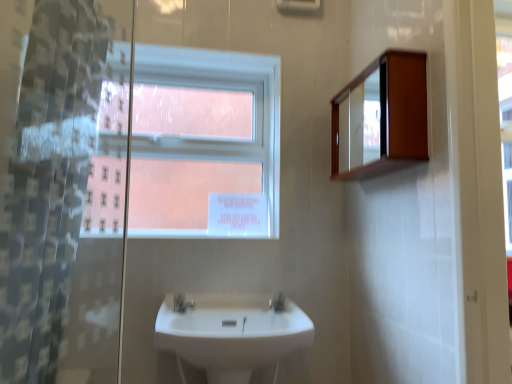
This screenshot has height=384, width=512. I want to click on white glossy sink at center, so click(231, 334).

Identify the location of white glossy tap at center, the 1th tap viewed from the right. (277, 302).

The height and width of the screenshot is (384, 512). Describe the element at coordinates (381, 118) in the screenshot. I see `wooden medicine cabinet at upper right` at that location.

Find the location of a particular element. The height and width of the screenshot is (384, 512). white plastic window at upper center is located at coordinates (204, 144).

You are a GUI agent. You are given a task and a screenshot of the screen. Output one action in this format:
    pyautogui.click(x=<x>, y=<y>)
    Task: Click on the white glossy sink at center
    The image size is (512, 384).
    Given the screenshot: What is the action you would take?
    pyautogui.click(x=231, y=334)

From the picture: Can you confirm if white glossy sink at center is positioned to the left of wooden medicine cabinet at upper right?

Indeed, white glossy sink at center is positioned on the left side of wooden medicine cabinet at upper right.

Who is bigger, white glossy sink at center or wooden medicine cabinet at upper right?

white glossy sink at center.

Which of these two, white glossy sink at center or wooden medicine cabinet at upper right, is thinner?

wooden medicine cabinet at upper right.

Is point (216, 298) behind point (393, 157)?

Yes, it is.

Is silver metallic tap at center, which is counted as the first tap, starting from the left, far from white plastic window at upper center?

That's not correct — silver metallic tap at center, which is counted as the first tap, starting from the left, is a little close to white plastic window at upper center.

Which is behind, point (182, 297) or point (238, 55)?

The point (238, 55) is more distant.

This screenshot has height=384, width=512. Find the location of `window above the silver metallic tap at center, which is counted as the first tap, starting from the left (from a real-world perspective)`. window above the silver metallic tap at center, which is counted as the first tap, starting from the left (from a real-world perspective) is located at coordinates (204, 144).

From a real-world perspective, is silver metallic tap at center, the second tap viewed from the right, physically below white plastic window at upper center?

Yes.

From the image's perspective, which object appears higher, clear plastic shower curtain at left or wooden medicine cabinet at upper right?

wooden medicine cabinet at upper right.

This screenshot has height=384, width=512. Find the location of `shower curtain that appears on the left of wooden medicine cabinet at upper right`. shower curtain that appears on the left of wooden medicine cabinet at upper right is located at coordinates (x=48, y=183).

Which is nearer, (26, 300) or (354, 93)?

The point (26, 300) is in front.

Measure the distance from wooden medicine cabinet at upper right to clear plastic shower curtain at left.

wooden medicine cabinet at upper right is 3.50 feet from clear plastic shower curtain at left.

From a real-world perspective, is wooden medicine cabinet at upper right located higher than clear plastic shower curtain at left?

Yes, from a real-world perspective, wooden medicine cabinet at upper right is on top of clear plastic shower curtain at left.

Considering the relative sizes of wooden medicine cabinet at upper right and clear plastic shower curtain at left in the image provided, is wooden medicine cabinet at upper right smaller than clear plastic shower curtain at left?

Actually, wooden medicine cabinet at upper right might be larger than clear plastic shower curtain at left.

Which is nearer, (x=369, y=88) or (x=35, y=171)?

Point (x=369, y=88) appears to be farther away from the viewer than point (x=35, y=171).

Is the surface of white glossy tap at center, the 2th tap in the left-to-right sequence, in direct contact with wooden medicine cabinet at upper right?

They are not placed beside each other.

In terms of width, does white glossy tap at center, the 1th tap viewed from the right, look wider or thinner when compared to wooden medicine cabinet at upper right?

Clearly, white glossy tap at center, the 1th tap viewed from the right, has less width compared to wooden medicine cabinet at upper right.

How different are the orientations of white glossy tap at center, the 2th tap in the left-to-right sequence, and wooden medicine cabinet at upper right in degrees?

There is a 60.9-degree angle between the facing directions of white glossy tap at center, the 2th tap in the left-to-right sequence, and wooden medicine cabinet at upper right.

Between white glossy tap at center, the 2th tap in the left-to-right sequence, and wooden medicine cabinet at upper right, which one has larger size?

wooden medicine cabinet at upper right is bigger.

Does silver metallic tap at center, the second tap viewed from the right, turn towards wooden medicine cabinet at upper right?

No, silver metallic tap at center, the second tap viewed from the right, is not turned towards wooden medicine cabinet at upper right.

From the image's perspective, is silver metallic tap at center, which is counted as the first tap, starting from the left, positioned above or below wooden medicine cabinet at upper right?

Clearly, from the image's perspective, silver metallic tap at center, which is counted as the first tap, starting from the left, is below wooden medicine cabinet at upper right.

Which point is more distant from viewer, (193, 301) or (333, 127)?

The point (333, 127) is farther.

Which object is positioned more to the left, silver metallic tap at center, which is counted as the first tap, starting from the left, or wooden medicine cabinet at upper right?

silver metallic tap at center, which is counted as the first tap, starting from the left.

Considering the relative sizes of white plastic window at upper center and clear plastic shower curtain at left in the image provided, is white plastic window at upper center smaller than clear plastic shower curtain at left?

Actually, white plastic window at upper center might be larger than clear plastic shower curtain at left.

Can you confirm if white plastic window at upper center is shorter than clear plastic shower curtain at left?

Yes, white plastic window at upper center is shorter than clear plastic shower curtain at left.

Is white plastic window at upper center wider or thinner than clear plastic shower curtain at left?

white plastic window at upper center is wider than clear plastic shower curtain at left.

Identify the location of sink that appears below the wooden medicine cabinet at upper right (from the image's perspective). The image size is (512, 384). (231, 334).

Locate an element on the screen. window above the silver metallic tap at center, the second tap viewed from the right (from a real-world perspective) is located at coordinates (204, 144).

Estimate the real-world distances between objects in this image. Which object is closer to white plastic window at upper center, wooden medicine cabinet at upper right or clear plastic shower curtain at left?

Among the two, wooden medicine cabinet at upper right is located nearer to white plastic window at upper center.

From the image, which object appears to be farther from white plastic window at upper center, clear plastic shower curtain at left or white glossy tap at center, the 2th tap in the left-to-right sequence?

white glossy tap at center, the 2th tap in the left-to-right sequence, is further to white plastic window at upper center.

Looking at the image, which one is located closer to clear plastic shower curtain at left, white plastic window at upper center or wooden medicine cabinet at upper right?

white plastic window at upper center is closer to clear plastic shower curtain at left.

Considering their positions, is white glossy sink at center positioned closer to white glossy tap at center, the 2th tap in the left-to-right sequence, than wooden medicine cabinet at upper right?

white glossy sink at center lies closer to white glossy tap at center, the 2th tap in the left-to-right sequence, than the other object.

Considering their positions, is wooden medicine cabinet at upper right positioned further to white glossy tap at center, the 2th tap in the left-to-right sequence, than white glossy sink at center?

wooden medicine cabinet at upper right.

Estimate the real-world distances between objects in this image. Which object is further from clear plastic shower curtain at left, white glossy sink at center or wooden medicine cabinet at upper right?

wooden medicine cabinet at upper right is further to clear plastic shower curtain at left.

Considering their positions, is silver metallic tap at center, which is counted as the first tap, starting from the left, positioned further to white glossy tap at center, the 1th tap viewed from the right, than white glossy sink at center?

The object further to white glossy tap at center, the 1th tap viewed from the right, is silver metallic tap at center, which is counted as the first tap, starting from the left.

Considering their positions, is clear plastic shower curtain at left positioned closer to wooden medicine cabinet at upper right than white glossy tap at center, the 1th tap viewed from the right?

white glossy tap at center, the 1th tap viewed from the right, is closer to wooden medicine cabinet at upper right.

The width and height of the screenshot is (512, 384). In order to click on tap that lies between wooden medicine cabinet at upper right and white glossy tap at center, the 1th tap viewed from the right, from top to bottom in this screenshot , I will do `click(182, 303)`.

Where is `tap between white plastic window at upper center and white glossy tap at center, the 2th tap in the left-to-right sequence, vertically`? This screenshot has width=512, height=384. tap between white plastic window at upper center and white glossy tap at center, the 2th tap in the left-to-right sequence, vertically is located at coordinates (182, 303).

I want to click on sink situated between silver metallic tap at center, which is counted as the first tap, starting from the left, and white glossy tap at center, the 2th tap in the left-to-right sequence, from left to right, so point(231,334).

This screenshot has width=512, height=384. I want to click on medicine cabinet located between clear plastic shower curtain at left and white glossy sink at center in the depth direction, so click(381, 118).